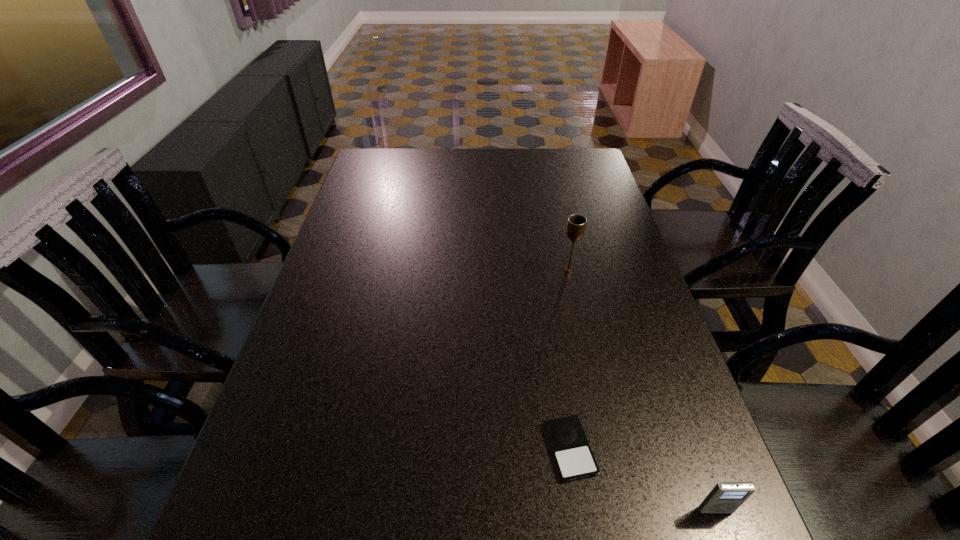
Where is `free spot between the leftmost object and the farthest object`? This screenshot has height=540, width=960. free spot between the leftmost object and the farthest object is located at coordinates (569, 360).

Where is `blank region between the second object from right to left and the second tallest object`? The height and width of the screenshot is (540, 960). blank region between the second object from right to left and the second tallest object is located at coordinates (642, 390).

At what (x,y) coordinates should I click in order to perform the action: click on vacant space that is in between the right iPod and the farther iPod. Please return your answer as a coordinate pair (x, y). Looking at the image, I should click on (642, 479).

This screenshot has height=540, width=960. I want to click on object that stands as the closest to the farthest object, so click(572, 454).

Identify the location of the second closest object to the tallest object. The image size is (960, 540). [x=726, y=497].

Identify the location of blank space that satisfies the following two spatial constraints: 1. on the back side of the farther iPod; 2. on the left side of the chalice. (542, 271).